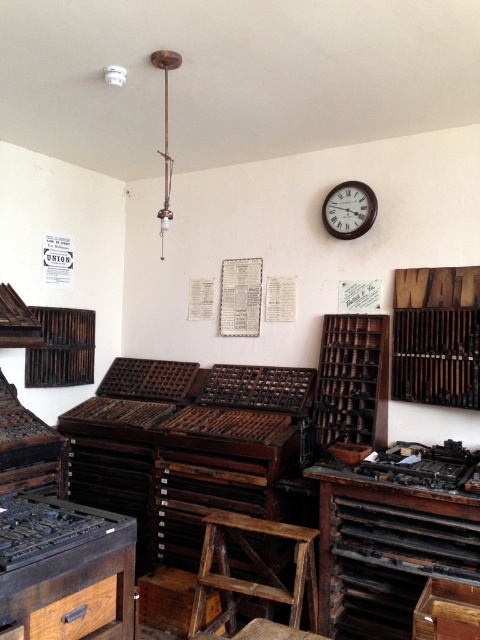
Is dark wood workbench at lower right smaller than wooden clock at upper center?

No, dark wood workbench at lower right is not smaller than wooden clock at upper center.

At what (x,y) coordinates should I click in order to perform the action: click on dark wood workbench at lower right. Please return your answer as a coordinate pair (x, y). The height and width of the screenshot is (640, 480). Looking at the image, I should click on (391, 541).

Is rustic wood stool at center to the left of wooden clock at upper center from the viewer's perspective?

Yes, rustic wood stool at center is to the left of wooden clock at upper center.

Is point (194, 608) in front of point (361, 221)?

Yes.

Does point (289, 620) come behind point (351, 212)?

No, it is not.

Locate an element on the screen. The image size is (480, 640). rustic wood stool at center is located at coordinates (256, 568).

From the picture: Can you confirm if dark brown wood workbench at lower left is smaller than rustic wood stool at center?

Yes, dark brown wood workbench at lower left is smaller than rustic wood stool at center.

Describe the element at coordinates (64, 570) in the screenshot. I see `dark brown wood workbench at lower left` at that location.

Locate an element on the screen. Image resolution: width=480 pixels, height=640 pixels. dark brown wood workbench at lower left is located at coordinates (64, 570).